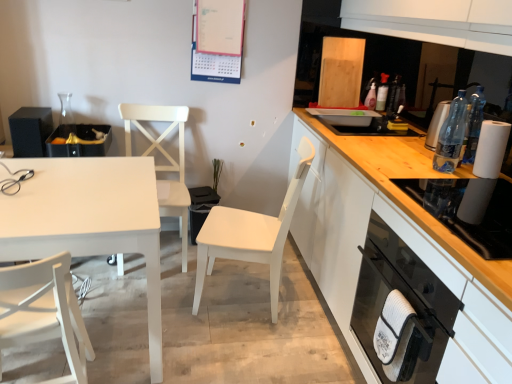
Identify the location of free space to the left of white paper at right. (446, 173).